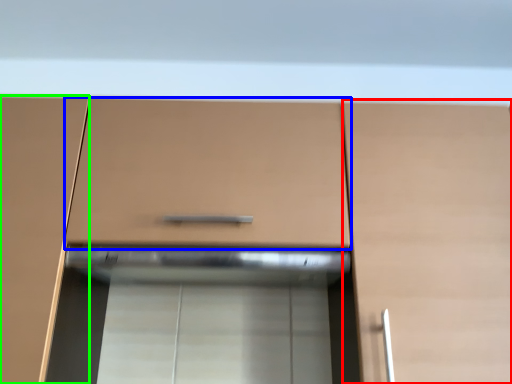
Question: Which object is positioned farthest from cabinetry (highlighted by a red box)? Select from drawer (highlighted by a blue box) and cabinetry (highlighted by a green box).

Choices:
 (A) drawer
 (B) cabinetry

Answer: (B)